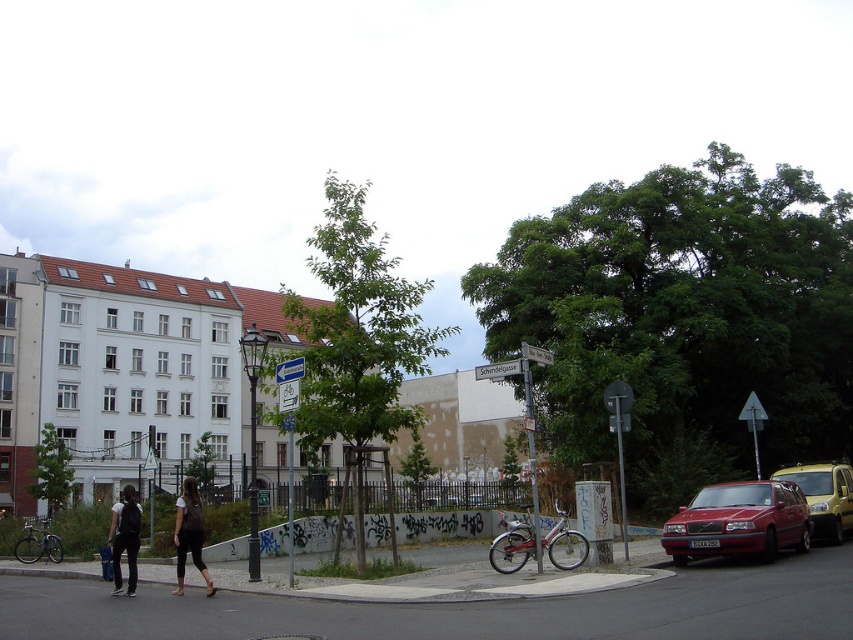
You are a pedestrian standing at the roundabout and see both the dark brown leather backpack at lower left and the dark gray fabric jacket at lower left. Which item is placed above the other?

The dark brown leather backpack at lower left is positioned over the dark gray fabric jacket at lower left.

You are standing at the roundabout center in the image and want to take a photo of the dark brown leather jacket at lower left. The camera you have is a standard DSLR with a 50mm lens. What should you do to ensure the jacket is in focus and fills the frame?

The dark brown leather jacket at lower left and camera are 13.18 meters apart from each other. To ensure the jacket is in focus and fills the frame with a 50mm lens, you should use a smaller aperture setting like f8 or higher to increase depth of field, and move closer if possible. However, since the distance is fixed at 13.18 meters, adjusting the aperture and using a tripod for stability will help achieve sharp focus.

You are standing at the roundabout center and want to reach the dark brown leather backpack at lower left. The path is clear. Can you walk straight to it without changing direction?

Yes, you can walk straight to the dark brown leather backpack at lower left because they are 43.32 feet apart in a straight line.